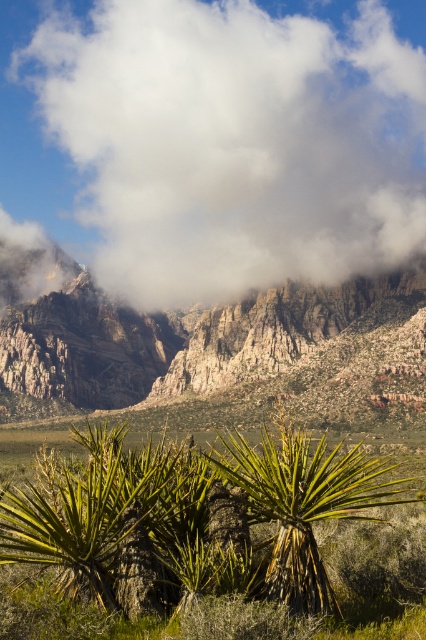
Question: Which of these objects is positioned closest to the white fluffy cloud at upper center?

Choices:
 (A) green leafy palm tree at center
 (B) rugged red rock formation at center

Answer: (B)

Question: Can you confirm if white fluffy cloud at upper center is positioned above rugged red rock formation at center?

Choices:
 (A) yes
 (B) no

Answer: (A)

Question: Does rugged red rock formation at center appear on the right side of green leafy palm tree at center?

Choices:
 (A) no
 (B) yes

Answer: (A)

Question: Is green leafy plant at center positioned behind green leafy palm tree at center?

Choices:
 (A) no
 (B) yes

Answer: (A)

Question: Based on their relative distances, which object is farther from the white fluffy cloud at upper center?

Choices:
 (A) green leafy palm tree at center
 (B) green leafy plant at center
 (C) rugged red rock formation at center

Answer: (A)

Question: Which of the following is the closest to the observer?

Choices:
 (A) (256, 308)
 (B) (337, 499)
 (C) (294, 275)
 (D) (157, 449)

Answer: (B)